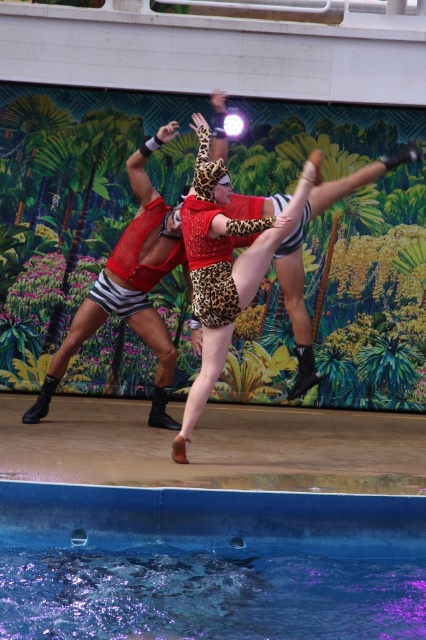
You are a stagehand who needs to adjust the height of the blue smooth water at lower center so it matches the leopard print leotard at center. Based on the scene description, how should you adjust the water level?

The blue smooth water at lower center is not as tall as the leopard print leotard at center, so you should raise the water level to match the height of the leopard print leotard at center.

You are a stagehand who needs to place a 3ft wide decorative panel between the blue smooth water at lower center and the leopard print leotard at center. Can you fit it there?

The blue smooth water at lower center is wider than the leopard print leotard at center. Since the decorative panel is 3ft wide, it depends on the available space between them. However, the description only mentions their widths relative to each other, not the exact distance between them. Without knowing the actual distance, it is impossible to determine if the panel will fit.